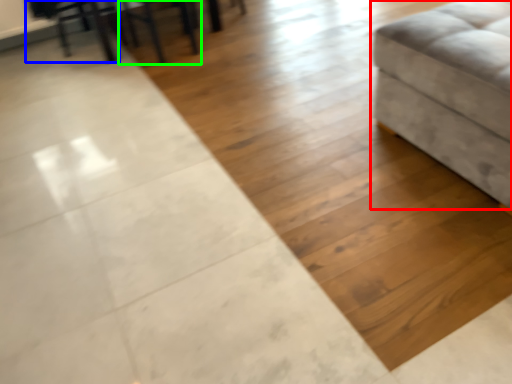
Question: Which object is positioned farthest from furniture (highlighted by a red box)? Select from swivel chair (highlighted by a blue box) and chair (highlighted by a green box).

Choices:
 (A) swivel chair
 (B) chair

Answer: (A)